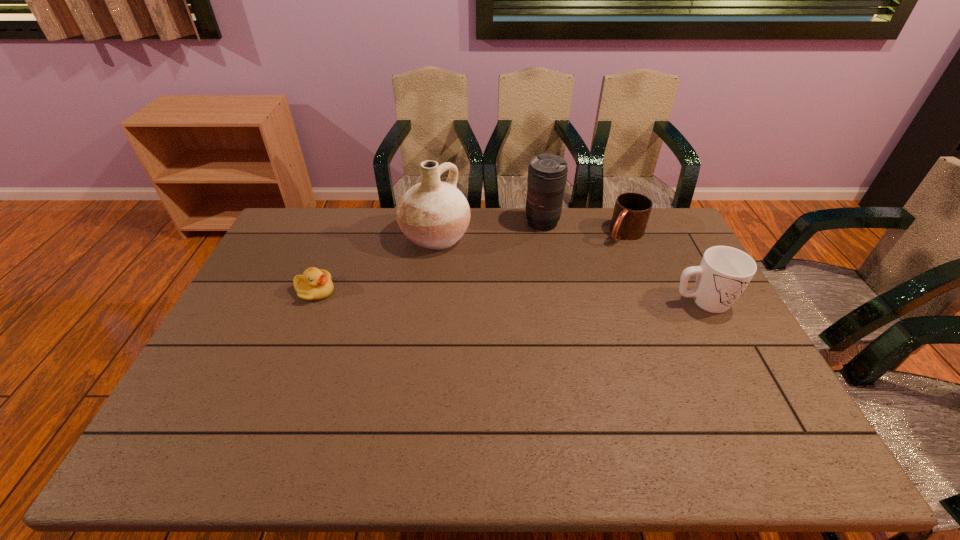
At what (x,y) coordinates should I click in order to perform the action: click on blank area located to pour from the handle of the fourth object from right to left. Please return your answer as a coordinate pair (x, y). Looking at the image, I should click on (519, 279).

Identify the location of vacant region located to pour from the handle of the fourth object from right to left. (474, 255).

Locate an element on the screen. vacant region located 0.160m to pour from the handle of the fourth object from right to left is located at coordinates (500, 268).

The width and height of the screenshot is (960, 540). Identify the location of free spot located on the side of the shorter mug with the handle. (599, 260).

Find the location of a particular element. The width and height of the screenshot is (960, 540). vacant space located on the side of the shorter mug with the handle is located at coordinates (571, 288).

Identify the location of vacant region located on the side of the shorter mug with the handle. The image size is (960, 540). (566, 294).

This screenshot has width=960, height=540. What are the coordinates of `vacant space situated 0.200m on the side of the fourth shortest object where the control switches are located` in the screenshot? It's located at (520, 266).

I want to click on vacant space located on the side of the fourth shortest object where the control switches are located, so click(x=527, y=254).

I want to click on blank space located 0.080m on the side of the fourth shortest object where the control switches are located, so click(531, 246).

Identify the location of pottery positioned at the far edge. The image size is (960, 540). (434, 215).